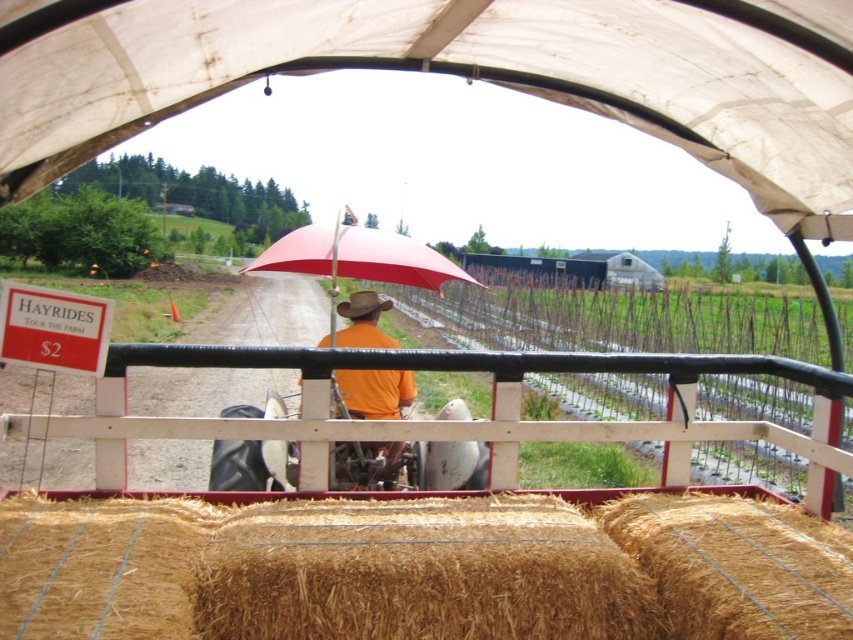
Does golden straw bales at lower center lie behind white fabric canopy at upper center?

That is True.

Can you confirm if golden straw bales at lower center is positioned to the left of white fabric canopy at upper center?

Indeed, golden straw bales at lower center is positioned on the left side of white fabric canopy at upper center.

The width and height of the screenshot is (853, 640). In order to click on golden straw bales at lower center in this screenshot , I will do `click(421, 570)`.

Is red matte umbrella at center wider than orange cotton shirt at center?

Yes, red matte umbrella at center is wider than orange cotton shirt at center.

Who is shorter, red matte umbrella at center or orange cotton shirt at center?

Standing shorter between the two is orange cotton shirt at center.

Measure the distance between red matte umbrella at center and camera.

red matte umbrella at center and camera are 13.39 feet apart.

The height and width of the screenshot is (640, 853). In order to click on red matte umbrella at center in this screenshot , I will do `click(358, 257)`.

Can you confirm if white fabric canopy at upper center is thinner than orange cotton shirt at center?

No, white fabric canopy at upper center is not thinner than orange cotton shirt at center.

Can you confirm if white fabric canopy at upper center is wider than orange cotton shirt at center?

Yes.

Is point (438, 17) less distant than point (368, 323)?

That is True.

What are the coordinates of `white fabric canopy at upper center` in the screenshot? It's located at (457, 76).